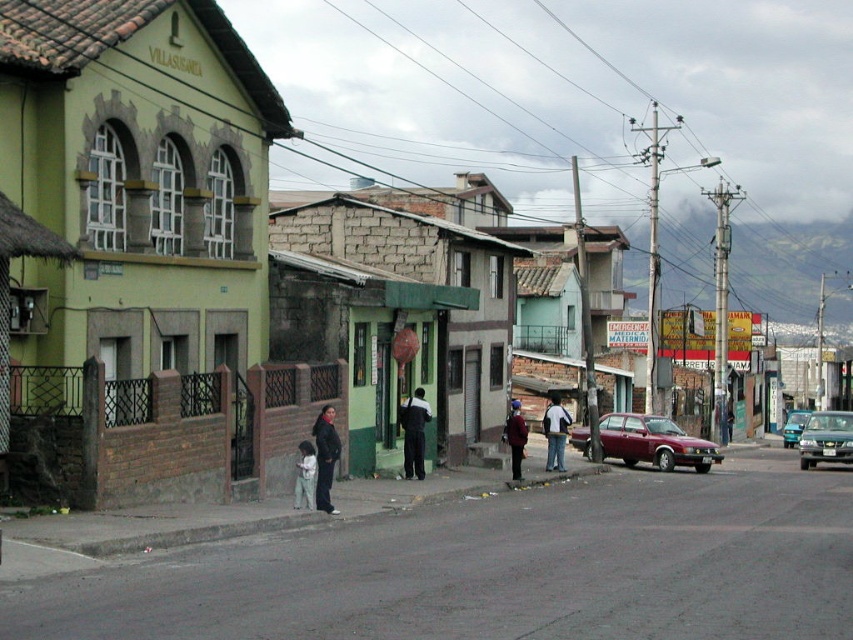
Question: Is light gray fabric pants at center wider than metallic silver van at center?

Choices:
 (A) no
 (B) yes

Answer: (A)

Question: Which object is positioned closest to the dark gray fabric jacket at lower center?

Choices:
 (A) metallic silver sedan at center
 (B) maroon fabric jacket at center

Answer: (B)

Question: Is maroon metallic sedan at center below dark gray fabric jacket at lower center?

Choices:
 (A) yes
 (B) no

Answer: (A)

Question: Which object appears farthest from the camera in this image?

Choices:
 (A) dark gray fabric jacket at lower center
 (B) white cotton shirt at center
 (C) light gray fabric pants at center

Answer: (B)

Question: Which object is the farthest from the metallic silver sedan at center?

Choices:
 (A) dark gray fabric jacket at lower center
 (B) light gray fabric pants at center

Answer: (B)

Question: Is dark gray pants at center thinner than white cotton shirt at center?

Choices:
 (A) no
 (B) yes

Answer: (B)